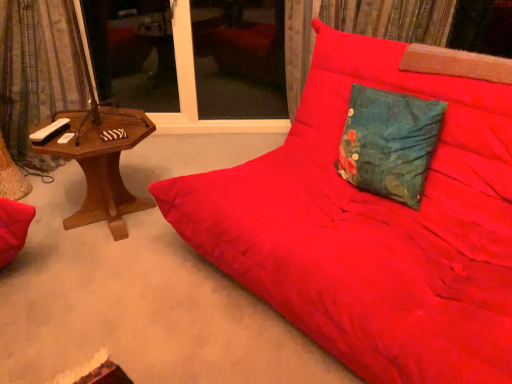
The width and height of the screenshot is (512, 384). In order to click on free space underneath woodenmaterial/texturetable at left (from a real-world perspective) in this screenshot , I will do `click(101, 221)`.